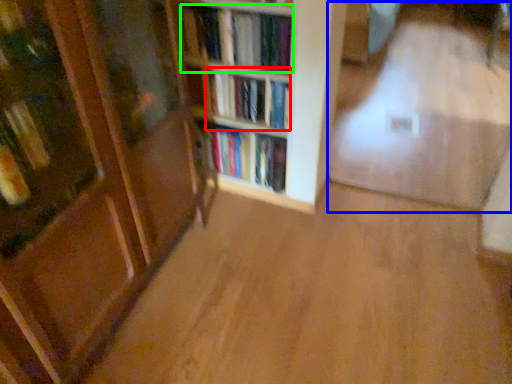
Question: Which object is the farthest from book (highlighted by a red box)? Choose among these: corridor (highlighted by a blue box) or book (highlighted by a green box).

Choices:
 (A) corridor
 (B) book

Answer: (A)